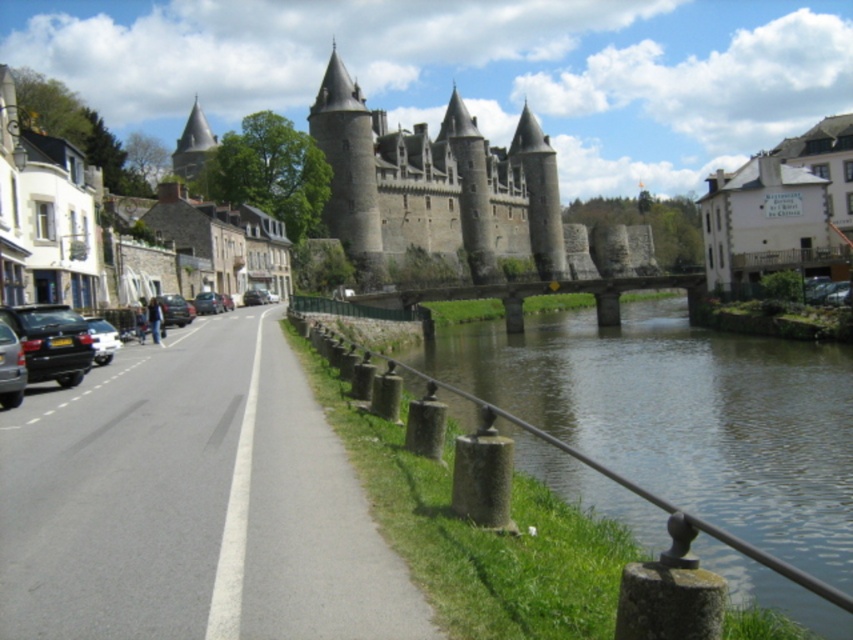
Is point (331, 202) positioned in front of point (160, 300)?

No, it is behind (160, 300).

Does gray stone castle at center appear over shiny black car at road center?

Yes.

Locate an element on the screen. This screenshot has width=853, height=640. gray stone castle at center is located at coordinates (434, 186).

Between gray stone castle at center and shiny black car at left, which one has less height?

With less height is shiny black car at left.

The image size is (853, 640). What do you see at coordinates (434, 186) in the screenshot?
I see `gray stone castle at center` at bounding box center [434, 186].

Is point (474, 253) positioned before point (9, 344)?

That is False.

The height and width of the screenshot is (640, 853). Identify the location of gray stone castle at center. (434, 186).

Who is lower down, green stone river at lower center or shiny black car at left?

shiny black car at left is lower down.

Is point (570, 339) behind point (4, 342)?

Yes, point (570, 339) is behind point (4, 342).

Which is behind, point (834, 381) or point (12, 342)?

Point (834, 381)

Locate an element on the screen. Image resolution: width=853 pixels, height=640 pixels. green stone river at lower center is located at coordinates (682, 416).